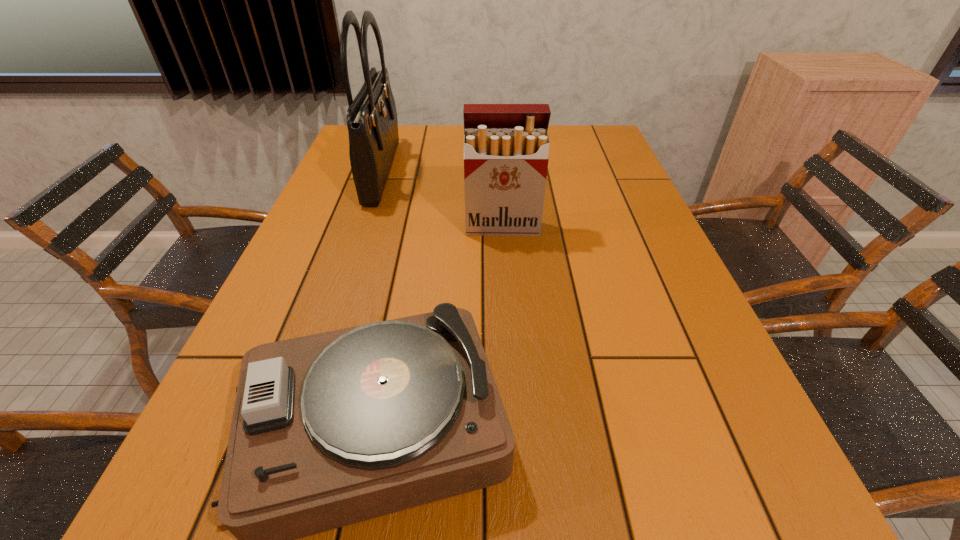
You are a GUI agent. You are given a task and a screenshot of the screen. Output one action in this format:
    pyautogui.click(x=<x>, y=<y>)
    Task: Click on the handbag
    The width and height of the screenshot is (960, 540).
    Given the screenshot: What is the action you would take?
    pyautogui.click(x=372, y=122)

Image resolution: width=960 pixels, height=540 pixels. In order to click on the farthest object in this screenshot , I will do `click(372, 122)`.

Where is `the second nearest object`? The width and height of the screenshot is (960, 540). the second nearest object is located at coordinates (506, 146).

I want to click on the second shortest object, so click(x=506, y=146).

This screenshot has width=960, height=540. I want to click on vacant space located with an open clasp on the front of the tallest object, so click(525, 172).

I want to click on vacant region located 0.340m with the lid open on the cigarette case, so click(510, 340).

Identify the location of object that is at the far edge. The image size is (960, 540). (372, 122).

Where is `object that is at the left edge`? Image resolution: width=960 pixels, height=540 pixels. object that is at the left edge is located at coordinates (372, 122).

The width and height of the screenshot is (960, 540). In order to click on object that is at the far left corner in this screenshot , I will do `click(372, 122)`.

The height and width of the screenshot is (540, 960). Identify the location of vacant space at the far edge of the desktop. (550, 129).